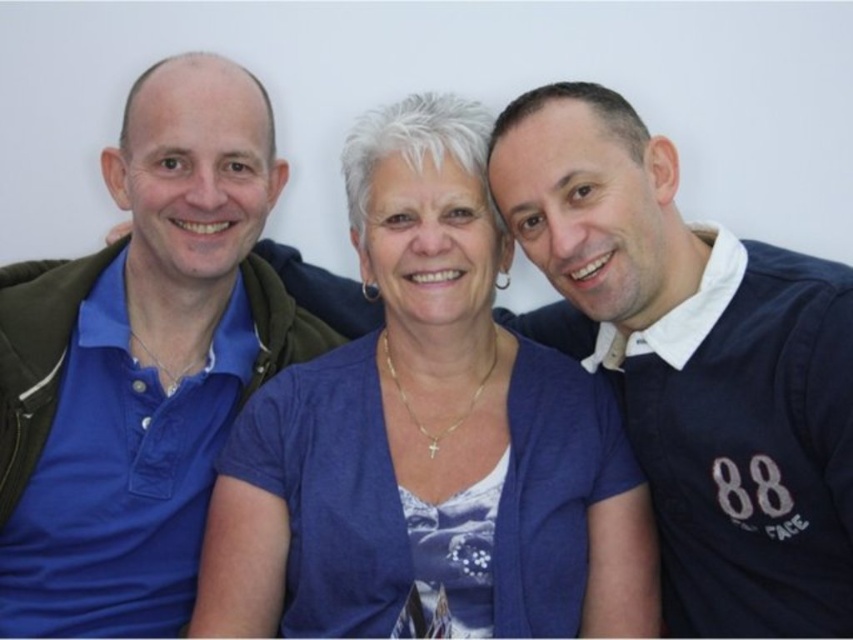
Question: Among these points, which one is nearest to the camera?

Choices:
 (A) (363, 436)
 (B) (548, 141)

Answer: (B)

Question: Does blue fabric shirt at center have a larger size compared to navy blue jersey at right?

Choices:
 (A) no
 (B) yes

Answer: (A)

Question: In this image, where is blue fabric shirt at center located relative to navy blue jersey at right?

Choices:
 (A) above
 (B) below

Answer: (B)

Question: Which object is closer to the camera taking this photo?

Choices:
 (A) blue fabric shirt at center
 (B) navy blue jersey at right
 (C) blue cotton polo shirt at left

Answer: (B)

Question: Considering the relative positions of navy blue jersey at right and blue cotton polo shirt at left in the image provided, where is navy blue jersey at right located with respect to blue cotton polo shirt at left?

Choices:
 (A) right
 (B) left

Answer: (A)

Question: Which point is farther to the camera?

Choices:
 (A) blue cotton polo shirt at left
 (B) navy blue jersey at right
 (C) blue fabric shirt at center

Answer: (A)